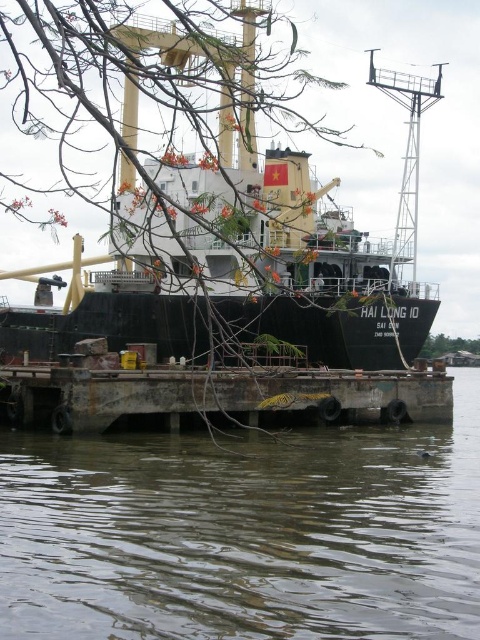
Does transparent water at lower center have a greater height compared to green leafy tree at lower right?

Yes, transparent water at lower center is taller than green leafy tree at lower right.

Which is in front, point (212, 584) or point (430, 344)?

Point (212, 584)

The height and width of the screenshot is (640, 480). I want to click on transparent water at lower center, so click(244, 532).

Which is in front, point (297, 632) or point (219, 257)?

Positioned in front is point (297, 632).

Looking at this image, which of these two, transparent water at lower center or black matte ship at center, stands taller?

black matte ship at center

This screenshot has height=640, width=480. What do you see at coordinates (244, 532) in the screenshot?
I see `transparent water at lower center` at bounding box center [244, 532].

I want to click on transparent water at lower center, so click(244, 532).

Can you confirm if black matte ship at center is smaller than green leafy tree at lower right?

Actually, black matte ship at center might be larger than green leafy tree at lower right.

Can you confirm if black matte ship at center is positioned to the right of green leafy tree at lower right?

Answer: In fact, black matte ship at center is to the left of green leafy tree at lower right.

Between point (123, 316) and point (431, 353), which one is positioned in front?

Point (123, 316) is more forward.

I want to click on black matte ship at center, so click(x=238, y=275).